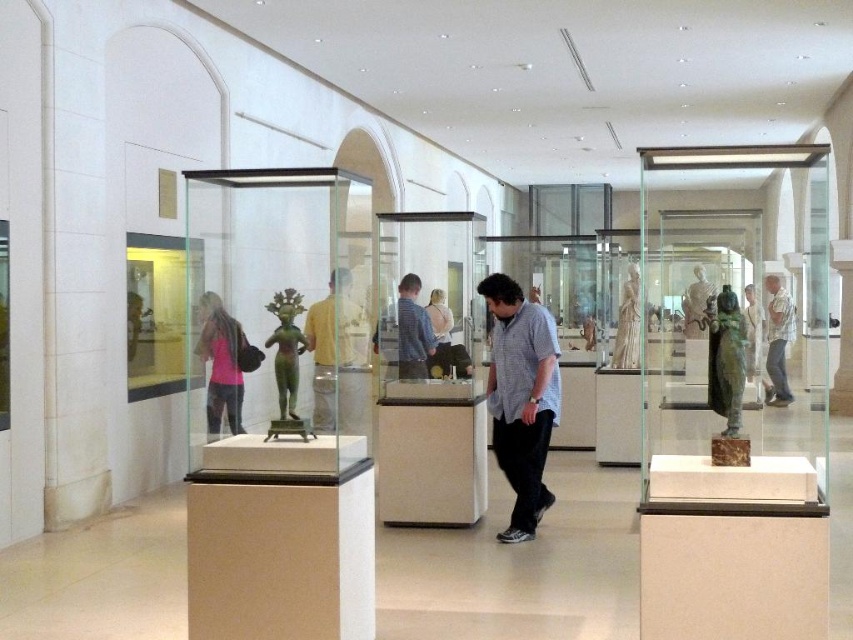
Is green polished stone statue at center wider than matte bronze statue at center?

No, green polished stone statue at center is not wider than matte bronze statue at center.

Measure the distance from green polished stone statue at center to matte bronze statue at center.

They are 5.08 meters apart.

At what (x,y) coordinates should I click in order to perform the action: click on green polished stone statue at center. Please return your answer as a coordinate pair (x, y). This screenshot has height=640, width=853. Looking at the image, I should click on (286, 362).

At what (x,y) coordinates should I click in order to perform the action: click on green polished stone statue at center. Please return your answer as a coordinate pair (x, y). The height and width of the screenshot is (640, 853). Looking at the image, I should click on (286, 362).

Measure the distance between checkered shirt at center and camera.

checkered shirt at center and camera are 16.70 feet apart.

Based on the photo, is checkered shirt at center positioned in front of green polished stone statue at center?

No, checkered shirt at center is further to the viewer.

Which is behind, point (541, 362) or point (306, 433)?

Point (541, 362)

Locate an element on the screen. checkered shirt at center is located at coordinates (521, 397).

Can you confirm if checkered shirt at center is shorter than matte bronze statue at center?

No.

What do you see at coordinates (521, 397) in the screenshot? Image resolution: width=853 pixels, height=640 pixels. I see `checkered shirt at center` at bounding box center [521, 397].

Find the location of a particular element. The height and width of the screenshot is (640, 853). checkered shirt at center is located at coordinates pos(521,397).